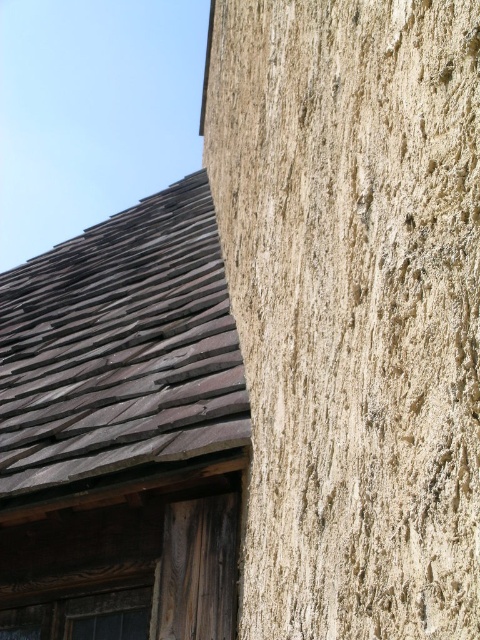
Question: Which point is farther from the camera taking this photo?

Choices:
 (A) (107, 596)
 (B) (39, 259)

Answer: (B)

Question: Is dark brown shingles at upper left wider than wooden textured window at lower left?

Choices:
 (A) no
 (B) yes

Answer: (B)

Question: Is dark brown shingles at upper left positioned behind wooden textured window at lower left?

Choices:
 (A) yes
 (B) no

Answer: (B)

Question: Which of the following is the closest to the observer?

Choices:
 (A) dark brown shingles at upper left
 (B) wooden textured window at lower left

Answer: (A)

Question: Can you confirm if dark brown shingles at upper left is positioned above wooden textured window at lower left?

Choices:
 (A) no
 (B) yes

Answer: (B)